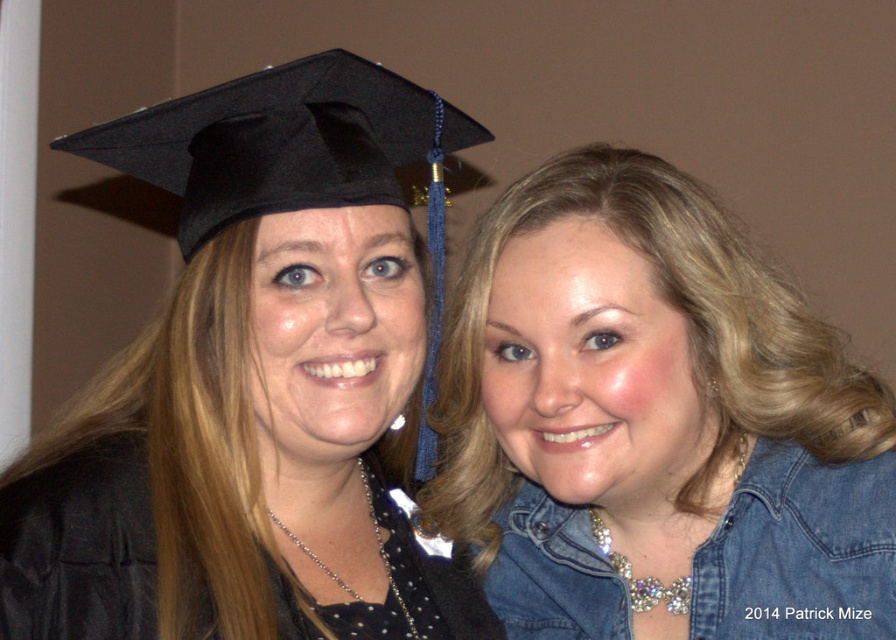
Can you confirm if denim jacket at upper right is wider than black matte graduation cap at upper left?

Yes.

Is denim jacket at upper right thinner than black matte graduation cap at upper left?

No.

This screenshot has width=896, height=640. Describe the element at coordinates (655, 422) in the screenshot. I see `denim jacket at upper right` at that location.

Where is `denim jacket at upper right`? This screenshot has width=896, height=640. denim jacket at upper right is located at coordinates (655, 422).

From the picture: Can you confirm if denim jacket at lower right is smaller than black matte gown at left?

Indeed, denim jacket at lower right has a smaller size compared to black matte gown at left.

Is the position of denim jacket at lower right more distant than that of black matte gown at left?

Yes, it is.

Image resolution: width=896 pixels, height=640 pixels. In order to click on denim jacket at lower right in this screenshot , I will do `click(799, 550)`.

Who is more forward, (332, 97) or (132, 465)?

Point (132, 465) is in front.

Locate an element on the screen. The height and width of the screenshot is (640, 896). black matte graduation cap at upper left is located at coordinates (279, 141).